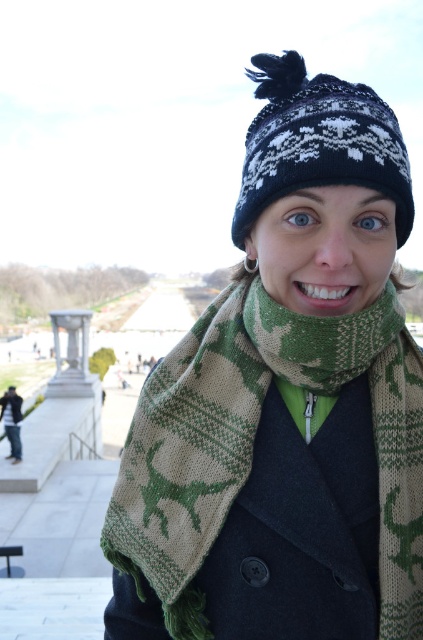
Can you confirm if green knitted scarf at center is positioned above black knitted hat at upper center?

Incorrect, green knitted scarf at center is not positioned above black knitted hat at upper center.

Who is higher up, green knitted scarf at center or black knitted hat at upper center?

Positioned higher is black knitted hat at upper center.

Which is in front, point (406, 384) or point (299, 125)?

Point (299, 125) is more forward.

Where is `green knitted scarf at center`? The image size is (423, 640). green knitted scarf at center is located at coordinates (257, 445).

Which is in front, point (189, 486) or point (13, 449)?

Point (189, 486) is more forward.

Which is behind, point (376, 424) or point (8, 406)?

Positioned behind is point (8, 406).

Image resolution: width=423 pixels, height=640 pixels. I want to click on green knitted scarf at center, so [257, 445].

Between black knitted hat at upper center and matte black coat at upper center, which one is positioned lower?

matte black coat at upper center is below.

Is black knitted hat at upper center above matte black coat at upper center?

Indeed, black knitted hat at upper center is positioned over matte black coat at upper center.

This screenshot has height=640, width=423. What do you see at coordinates (318, 141) in the screenshot?
I see `black knitted hat at upper center` at bounding box center [318, 141].

You are a GUI agent. You are given a task and a screenshot of the screen. Output one action in this format:
    pyautogui.click(x=<x>, y=<y>)
    Task: Click on the black knitted hat at upper center
    The height and width of the screenshot is (640, 423).
    Given the screenshot: What is the action you would take?
    pyautogui.click(x=318, y=141)